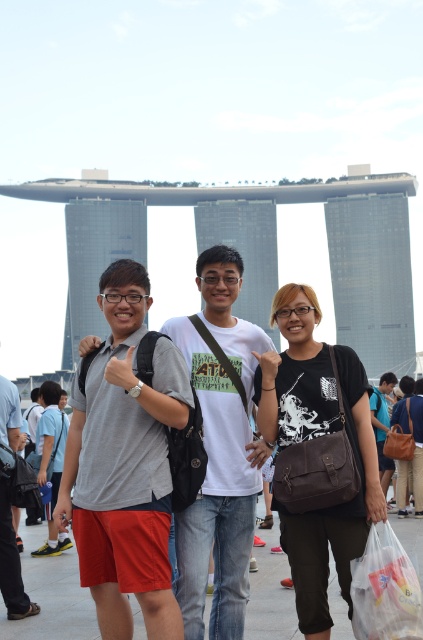
Who is more distant from viewer, (379, 628) or (40, 449)?

Positioned behind is point (40, 449).

Between translucent plastic bag at lower right and light blue jeans at lower left, which one has less height?

Standing shorter between the two is translucent plastic bag at lower right.

The image size is (423, 640). I want to click on translucent plastic bag at lower right, so click(384, 589).

Which is in front, point (321, 564) or point (414, 467)?

Point (321, 564) is more forward.

Which is more to the right, matte black bag at center or brown leather bag at center?

brown leather bag at center is more to the right.

Is point (288, 321) in front of point (403, 496)?

Yes, it is in front of point (403, 496).

Identify the location of matte black bag at center. Image resolution: width=423 pixels, height=640 pixels. (335, 512).

The image size is (423, 640). Describe the element at coordinates (335, 512) in the screenshot. I see `matte black bag at center` at that location.

Is matte black bag at center to the left of translucent plastic bag at lower right from the viewer's perspective?

Indeed, matte black bag at center is positioned on the left side of translucent plastic bag at lower right.

Is point (329, 515) farther from viewer compared to point (370, 572)?

That is True.

The width and height of the screenshot is (423, 640). What are the coordinates of `matte black bag at center` in the screenshot? It's located at (335, 512).